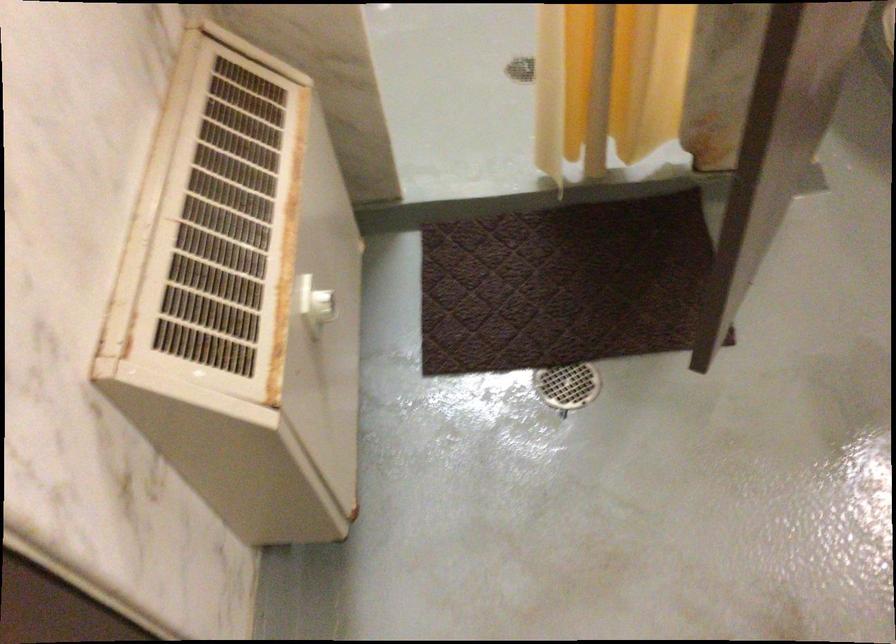
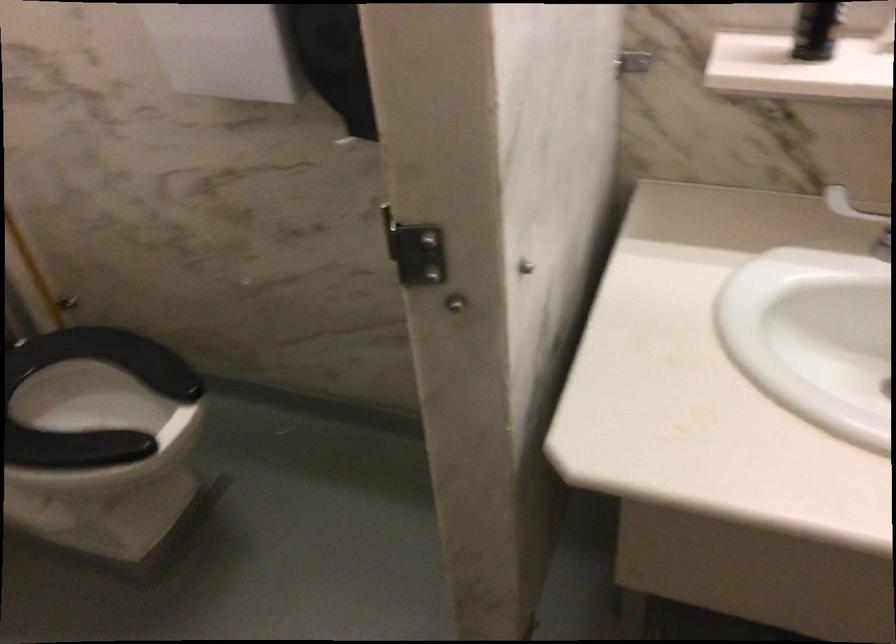
Question: The images are taken continuously from a first-person perspective. In which direction is your viewpoint rotating?

Choices:
 (A) Left
 (B) Right
 (C) Up
 (D) Down

Answer: (B)